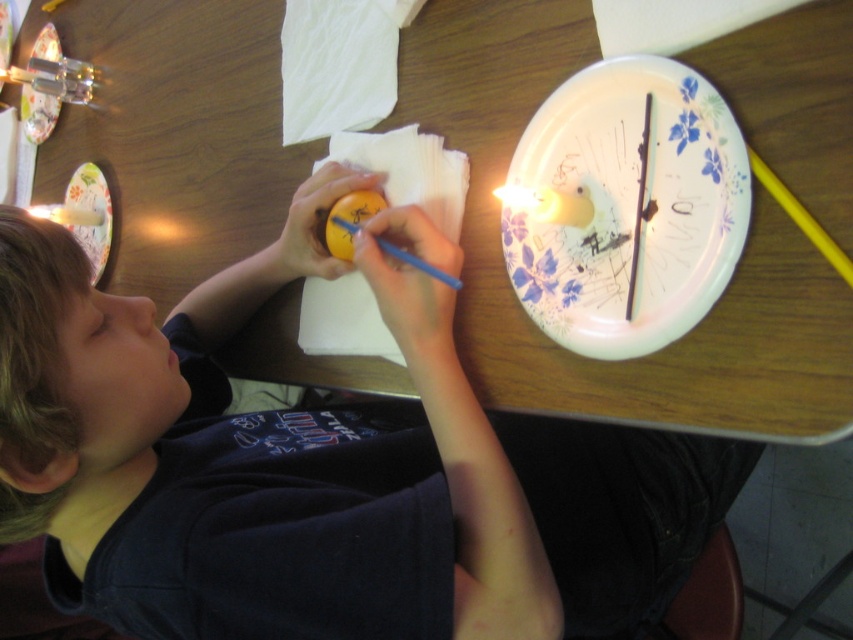
In the scene shown: What is the 2D coordinate of the wooden table at center?

The wooden table at center is located at the 2D coordinate point of (663, 348).